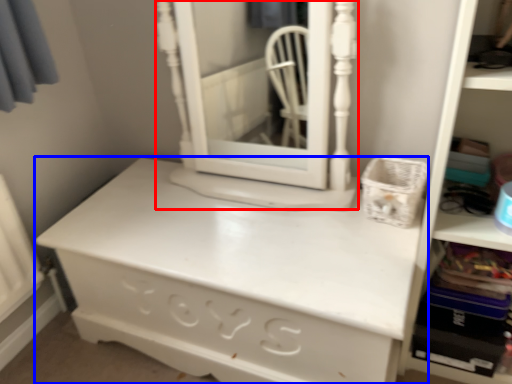
Question: Which of the following is the closest to the observer, medicine cabinet (highlighted by a red box) or chest of drawers (highlighted by a blue box)?

Choices:
 (A) medicine cabinet
 (B) chest of drawers

Answer: (B)